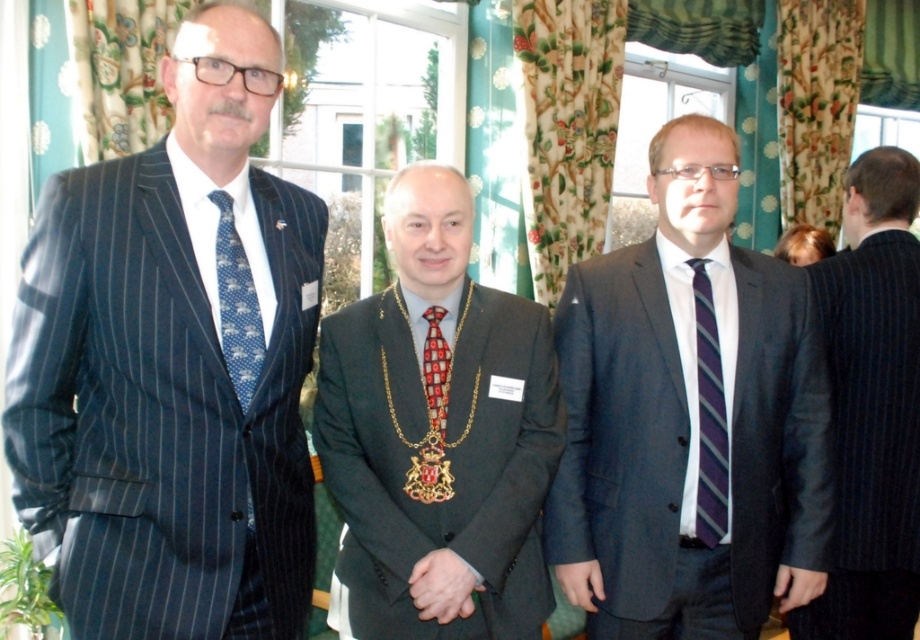
You are a photographer preparing to take a group portrait of the three men. You need to position the men so that the shiny black suit at center is to the left of the purple striped tie at center. Is this already the case in the current arrangement?

Yes, the shiny black suit at center is already positioned to the left of the purple striped tie at center in the current arrangement.

Looking at this image, you are a photographer at an event and need to position yourself to capture a photo of the matte black suit at center and the dark pinstripe suit at right. Based on their positions, which direction should you move to ensure both are in frame?

Since the matte black suit at center is to the left of the dark pinstripe suit at right, you should position yourself to the left of both suits to ensure both are in frame.

You are a photographer positioned at the camera. You need to capture a closeup shot of the dark pinstripe suit at right. Given that your camera can focus on objects within 5 feet, will you be able to take the closeup without moving closer?

The dark pinstripe suit at right is 6.23 feet away from the camera, which is beyond the camera focus range of 5 feet. Therefore, you cannot take the closeup without moving closer.